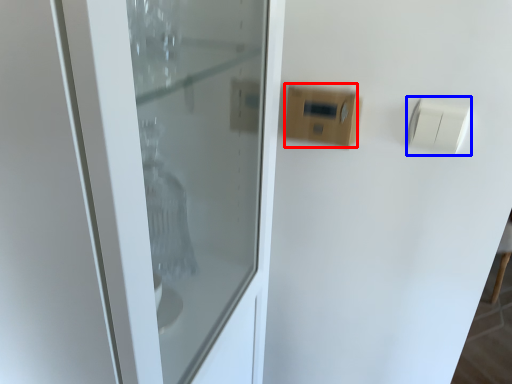
Question: Which object is closer to the camera taking this photo, light switch (highlighted by a red box) or light switch (highlighted by a blue box)?

Choices:
 (A) light switch
 (B) light switch

Answer: (B)